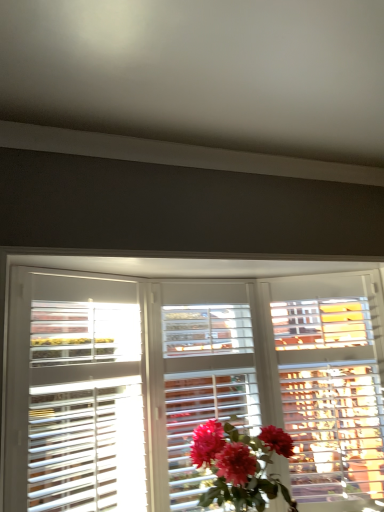
Question: In terms of width, does matte pink petals at center look wider or thinner when compared to white wooden blinds at center?

Choices:
 (A) wide
 (B) thin

Answer: (B)

Question: Visually, is matte pink petals at center positioned to the left or to the right of white wooden blinds at center?

Choices:
 (A) right
 (B) left

Answer: (A)

Question: From a real-world perspective, is matte pink petals at center physically located above or below white wooden blinds at center?

Choices:
 (A) above
 (B) below

Answer: (B)

Question: Is white wooden blinds at center inside or outside of matte pink petals at center?

Choices:
 (A) outside
 (B) inside

Answer: (A)

Question: Looking at their shapes, would you say white wooden blinds at center is wider or thinner than matte pink petals at center?

Choices:
 (A) wide
 (B) thin

Answer: (A)

Question: From the image's perspective, is white wooden blinds at center above or below matte pink petals at center?

Choices:
 (A) below
 (B) above

Answer: (B)

Question: Considering the relative positions of white wooden blinds at center and matte pink petals at center in the image provided, is white wooden blinds at center to the left or to the right of matte pink petals at center?

Choices:
 (A) left
 (B) right

Answer: (A)